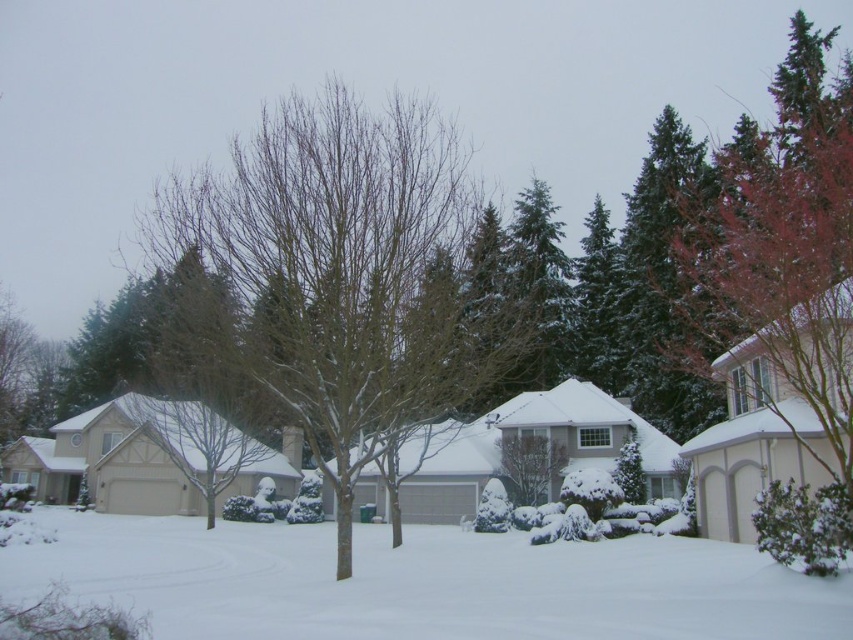
Which is in front, point (64, 513) or point (555, 234)?

Point (64, 513)

Is white fluffy snow at center thinner than green textured evergreen tree at center?

Incorrect, white fluffy snow at center's width is not less than green textured evergreen tree at center's.

The width and height of the screenshot is (853, 640). What do you see at coordinates (421, 582) in the screenshot?
I see `white fluffy snow at center` at bounding box center [421, 582].

Locate an element on the screen. Image resolution: width=853 pixels, height=640 pixels. white fluffy snow at center is located at coordinates (421, 582).

Is point (207, 205) closer to viewer compared to point (538, 332)?

Yes, point (207, 205) is closer to viewer.

Does bare branches at center come behind green textured evergreen tree at center?

That is False.

The height and width of the screenshot is (640, 853). I want to click on bare branches at center, so click(x=343, y=275).

The width and height of the screenshot is (853, 640). Find the location of `bare branches at center`. bare branches at center is located at coordinates (343, 275).

Measure the distance between bare branches at center and camera.

The distance of bare branches at center from camera is 15.65 meters.

Is bare branches at center bigger than white fluffy snow at center?

Indeed, bare branches at center has a larger size compared to white fluffy snow at center.

This screenshot has width=853, height=640. I want to click on bare branches at center, so click(x=343, y=275).

Image resolution: width=853 pixels, height=640 pixels. I want to click on bare branches at center, so click(343, 275).